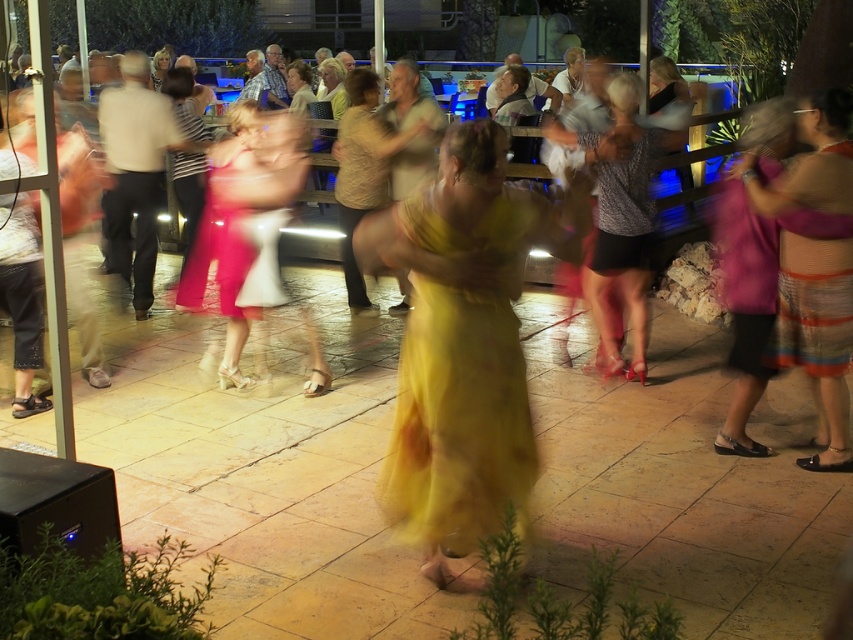
Question: Does yellow satin dress at center appear under striped dress at right?

Choices:
 (A) no
 (B) yes

Answer: (B)

Question: Among these points, which one is farthest from the camera?

Choices:
 (A) (819, 124)
 (B) (517, 365)

Answer: (A)

Question: Is yellow satin dress at center to the left of striped dress at right from the viewer's perspective?

Choices:
 (A) yes
 (B) no

Answer: (A)

Question: Does yellow satin dress at center appear over striped dress at right?

Choices:
 (A) no
 (B) yes

Answer: (A)

Question: Among these objects, which one is farthest from the camera?

Choices:
 (A) striped dress at right
 (B) yellow satin dress at center

Answer: (A)